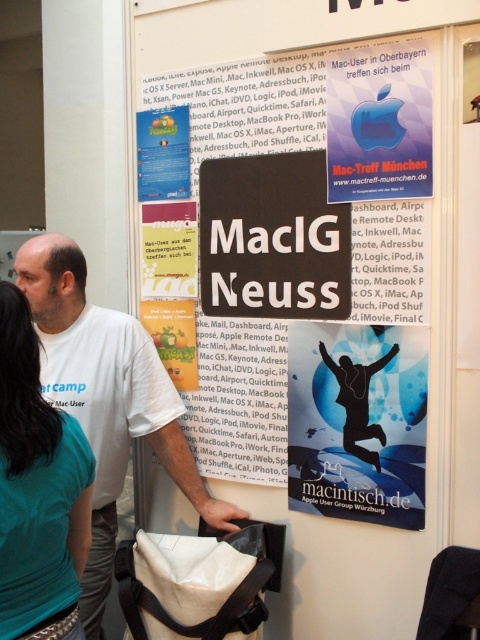
Can you confirm if blue glossy poster at center is wider than teal fabric shirt at upper left?

Yes.

Is blue glossy poster at center to the left of teal fabric shirt at upper left from the viewer's perspective?

No, blue glossy poster at center is not to the left of teal fabric shirt at upper left.

Who is more distant from viewer, (334, 499) or (8, 445)?

Positioned behind is point (334, 499).

Where is `blue glossy poster at center`? The image size is (480, 640). blue glossy poster at center is located at coordinates (358, 422).

Does white t-shirt at center have a lesser height compared to teal fabric shirt at upper left?

No.

Is white t-shirt at center taller than teal fabric shirt at upper left?

Indeed, white t-shirt at center has a greater height compared to teal fabric shirt at upper left.

Between point (48, 232) and point (45, 451), which one is positioned in front?

Point (45, 451)

Find the location of a particular element. Image resolution: width=480 pixels, height=640 pixels. white t-shirt at center is located at coordinates (106, 397).

This screenshot has height=640, width=480. What do you see at coordinates (240, 401) in the screenshot? I see `black cardboard sign at center` at bounding box center [240, 401].

Between point (307, 52) and point (21, 416), which one is positioned behind?

Positioned behind is point (307, 52).

The width and height of the screenshot is (480, 640). Find the location of `black cardboard sign at center`. black cardboard sign at center is located at coordinates (240, 401).